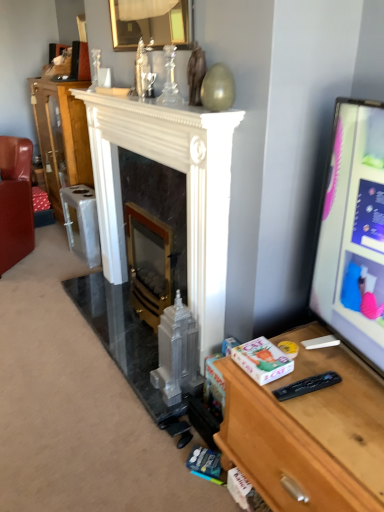
This screenshot has width=384, height=512. Describe the element at coordinates (153, 234) in the screenshot. I see `gold metallic fireplace at center, positioned as the 2th fireplace in left-to-right order` at that location.

What is the approximate height of matte black monitor at right?

matte black monitor at right is 76.53 centimeters tall.

The height and width of the screenshot is (512, 384). I want to click on leather couch at left, so click(15, 201).

Where is `white marble fireplace at center`? white marble fireplace at center is located at coordinates (61, 136).

Considering the sizes of objects wooden desk at right and white marble fireplace at center in the image provided, who is thinner, wooden desk at right or white marble fireplace at center?

With smaller width is white marble fireplace at center.

Based on the photo, how different are the orientations of wooden desk at right and white marble fireplace at center in degrees?

The angular difference between wooden desk at right and white marble fireplace at center is 0.764 degrees.

Choose the correct answer: Is wooden desk at right inside white marble fireplace at center or outside it?

wooden desk at right is outside white marble fireplace at center.

Based on their positions, is wooden desk at right located to the left or right of white marble fireplace at center, acting as the second fireplace starting from the right?

From the image, it's evident that wooden desk at right is to the right of white marble fireplace at center, acting as the second fireplace starting from the right.

Is wooden desk at right positioned beyond the bounds of white marble fireplace at center, arranged as the 1th fireplace when viewed from the left?

Yes, wooden desk at right is not within white marble fireplace at center, arranged as the 1th fireplace when viewed from the left.

Considering the points (248, 376) and (233, 116), which point is behind, point (248, 376) or point (233, 116)?

Point (233, 116)

How many degrees apart are the facing directions of wooden desk at right and white marble fireplace at center, acting as the second fireplace starting from the right?

The facing directions of wooden desk at right and white marble fireplace at center, acting as the second fireplace starting from the right, are 0.937 degrees apart.

The height and width of the screenshot is (512, 384). Find the location of `computer monitor that is in front of the gold metallic fireplace at center, positioned as the 2th fireplace in left-to-right order`. computer monitor that is in front of the gold metallic fireplace at center, positioned as the 2th fireplace in left-to-right order is located at coordinates (353, 231).

Does gold metallic fireplace at center, positioned as the 2th fireplace in left-to-right order, appear on the left side of matte black monitor at right?

Indeed, gold metallic fireplace at center, positioned as the 2th fireplace in left-to-right order, is positioned on the left side of matte black monitor at right.

Which of these two, gold metallic fireplace at center, the first fireplace when ordered from right to left, or matte black monitor at right, is bigger?

With larger size is matte black monitor at right.

The image size is (384, 512). I want to click on furniture on the left side of white marble fireplace at center, acting as the second fireplace starting from the right, so coord(15,201).

Is leather couch at left to the left of white marble fireplace at center, arranged as the 1th fireplace when viewed from the left, from the viewer's perspective?

Correct, you'll find leather couch at left to the left of white marble fireplace at center, arranged as the 1th fireplace when viewed from the left.

Between leather couch at left and white marble fireplace at center, acting as the second fireplace starting from the right, which one has larger width?

leather couch at left.

How many degrees apart are the facing directions of leather couch at left and white marble fireplace at center, acting as the second fireplace starting from the right?

There is a 46.8-degree angle between the facing directions of leather couch at left and white marble fireplace at center, acting as the second fireplace starting from the right.

Do you think matte black monitor at right is within leather couch at left, or outside of it?

matte black monitor at right lies outside leather couch at left.

Considering the relative sizes of matte black monitor at right and leather couch at left in the image provided, is matte black monitor at right shorter than leather couch at left?

Yes.

Who is smaller, matte black monitor at right or leather couch at left?

Smaller between the two is matte black monitor at right.

Which is less distant, (335, 152) or (11, 194)?

The point (335, 152) is more forward.

Locate an element on the screen. computer monitor located above the white marble fireplace at center (from a real-world perspective) is located at coordinates (353, 231).

Between matte black monitor at right and white marble fireplace at center, which one is positioned behind?

white marble fireplace at center.

Between point (373, 169) and point (61, 131), which one is positioned behind?

The point (61, 131) is behind.

From the image's perspective, between white marble fireplace at center and leather couch at left, which one is located above?

white marble fireplace at center appears higher in the image.

From a real-world perspective, between white marble fireplace at center and leather couch at left, who is vertically lower?

leather couch at left is physically lower.

Who is bigger, white marble fireplace at center or leather couch at left?

With larger size is white marble fireplace at center.

Visually, is white marble fireplace at center positioned to the left or to the right of leather couch at left?

white marble fireplace at center is to the right of leather couch at left.

Where is `desk below the white marble fireplace at center (from the image's perspective)`? The width and height of the screenshot is (384, 512). desk below the white marble fireplace at center (from the image's perspective) is located at coordinates (308, 431).

You are a GUI agent. You are given a task and a screenshot of the screen. Output one action in this format:
    pyautogui.click(x=<x>, y=<y>)
    Task: Click on the desk that appears on the right of white marble fireplace at center, acting as the second fireplace starting from the right
    The height and width of the screenshot is (512, 384).
    Given the screenshot: What is the action you would take?
    pyautogui.click(x=308, y=431)

Estimate the real-world distances between objects in this image. Which object is closer to wooden desk at right, white marble fireplace at center, acting as the second fireplace starting from the right, or white marble fireplace at center?

Based on the image, white marble fireplace at center, acting as the second fireplace starting from the right, appears to be nearer to wooden desk at right.

Consider the image. Which object lies further to the anchor point wooden desk at right, gold metallic fireplace at center, the first fireplace when ordered from right to left, or white marble fireplace at center?

Based on the image, white marble fireplace at center appears to be further to wooden desk at right.

Which object lies further to the anchor point matte black monitor at right, leather couch at left or wooden desk at right?

The object further to matte black monitor at right is leather couch at left.

In the scene shown: Based on their spatial positions, is leather couch at left or white marble fireplace at center further from wooden desk at right?

white marble fireplace at center.

Considering their positions, is gold metallic fireplace at center, positioned as the 2th fireplace in left-to-right order, positioned further to white marble fireplace at center, arranged as the 1th fireplace when viewed from the left, than leather couch at left?

leather couch at left lies further to white marble fireplace at center, arranged as the 1th fireplace when viewed from the left, than the other object.

When comparing their distances from white marble fireplace at center, does white marble fireplace at center, acting as the second fireplace starting from the right, or matte black monitor at right seem closer?

white marble fireplace at center, acting as the second fireplace starting from the right, is closer to white marble fireplace at center.

Looking at the image, which one is located further to matte black monitor at right, white marble fireplace at center or leather couch at left?

leather couch at left lies further to matte black monitor at right than the other object.

Consider the image. Looking at the image, which one is located further to white marble fireplace at center, acting as the second fireplace starting from the right, white marble fireplace at center or wooden desk at right?

Based on the image, white marble fireplace at center appears to be further to white marble fireplace at center, acting as the second fireplace starting from the right.

Find the location of `fireplace between wooden desk at right and gold metallic fireplace at center, positioned as the 2th fireplace in left-to-right order, in the front-back direction`. fireplace between wooden desk at right and gold metallic fireplace at center, positioned as the 2th fireplace in left-to-right order, in the front-back direction is located at coordinates (186, 189).

Locate an element on the screen. fireplace located between matte black monitor at right and gold metallic fireplace at center, the first fireplace when ordered from right to left, in the depth direction is located at coordinates (186, 189).

The image size is (384, 512). Identify the location of desk situated between white marble fireplace at center, arranged as the 1th fireplace when viewed from the left, and matte black monitor at right from left to right. (308, 431).

Identify the location of fireplace between leather couch at left and gold metallic fireplace at center, the first fireplace when ordered from right to left, from left to right. (186, 189).